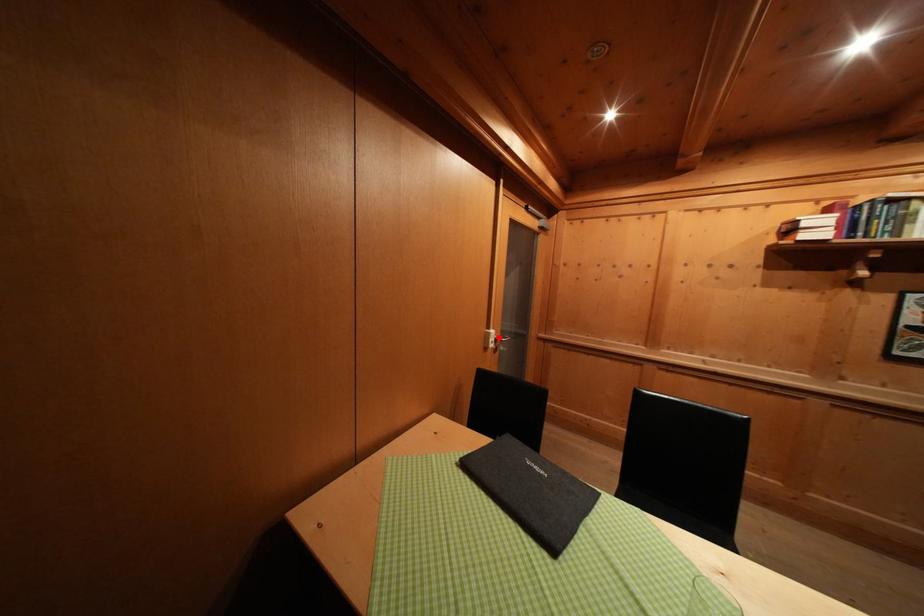
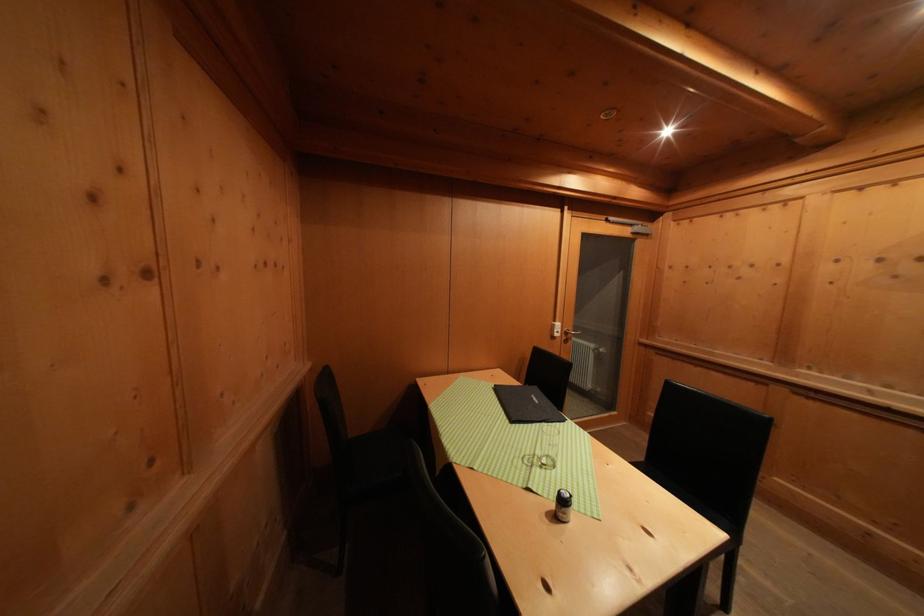
The point at the highlighted location is marked in the first image. Where is the corresponding point in the second image?

(564, 330)